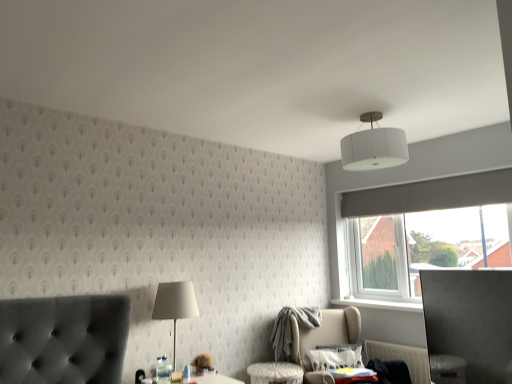
Question: Does white plastic radiator at lower right appear on the left side of beige fabric swivel chair at lower right?

Choices:
 (A) yes
 (B) no

Answer: (B)

Question: Considering the relative positions of white plastic radiator at lower right and beige fabric swivel chair at lower right in the image provided, is white plastic radiator at lower right behind beige fabric swivel chair at lower right?

Choices:
 (A) yes
 (B) no

Answer: (A)

Question: Considering the relative sizes of white plastic radiator at lower right and beige fabric swivel chair at lower right in the image provided, is white plastic radiator at lower right bigger than beige fabric swivel chair at lower right?

Choices:
 (A) yes
 (B) no

Answer: (B)

Question: Is white plastic radiator at lower right outside of beige fabric swivel chair at lower right?

Choices:
 (A) no
 (B) yes

Answer: (B)

Question: Can beige fabric swivel chair at lower right be found inside white plastic radiator at lower right?

Choices:
 (A) no
 (B) yes

Answer: (A)

Question: Considering the positions of white fabric lampshade at center and white ribbed shade at upper center in the image, is white fabric lampshade at center bigger or smaller than white ribbed shade at upper center?

Choices:
 (A) small
 (B) big

Answer: (A)

Question: Is white fabric lampshade at center wider or thinner than white ribbed shade at upper center?

Choices:
 (A) thin
 (B) wide

Answer: (A)

Question: From a real-world perspective, is white fabric lampshade at center physically located above or below white ribbed shade at upper center?

Choices:
 (A) below
 (B) above

Answer: (A)

Question: Does point (174, 369) appear closer or farther from the camera than point (376, 145)?

Choices:
 (A) farther
 (B) closer

Answer: (A)

Question: From a real-world perspective, is white ribbed shade at upper center positioned above or below beige fabric swivel chair at lower right?

Choices:
 (A) above
 (B) below

Answer: (A)

Question: From their relative heights in the image, would you say white ribbed shade at upper center is taller or shorter than beige fabric swivel chair at lower right?

Choices:
 (A) tall
 (B) short

Answer: (B)

Question: Would you say white ribbed shade at upper center is inside or outside beige fabric swivel chair at lower right?

Choices:
 (A) inside
 (B) outside

Answer: (B)

Question: From the image's perspective, is white ribbed shade at upper center located above or below beige fabric swivel chair at lower right?

Choices:
 (A) above
 (B) below

Answer: (A)

Question: Looking at the image, does white ribbed shade at upper center seem bigger or smaller compared to white plastic radiator at lower right?

Choices:
 (A) big
 (B) small

Answer: (A)

Question: Considering the positions of point (371, 160) and point (408, 357), is point (371, 160) closer or farther from the camera than point (408, 357)?

Choices:
 (A) closer
 (B) farther

Answer: (A)